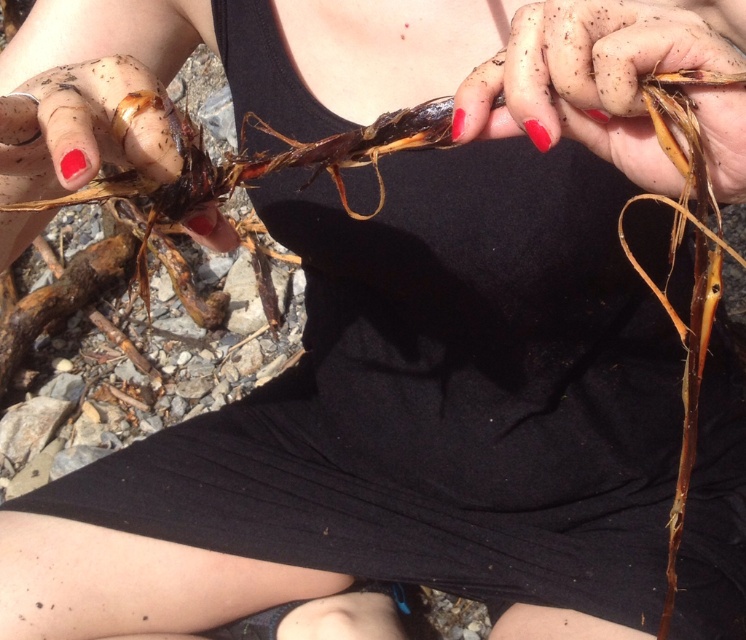
Question: Which point appears closest to the camera in this image?

Choices:
 (A) (151, 118)
 (B) (521, 65)

Answer: (B)

Question: Observing the image, what is the correct spatial positioning of dull brown skin at center in reference to matte brown root at left?

Choices:
 (A) right
 (B) left

Answer: (A)

Question: Which point is farther to the camera?

Choices:
 (A) dull brown skin at center
 (B) matte brown root at left

Answer: (B)

Question: Can you confirm if dull brown skin at center is positioned to the left of matte brown root at left?

Choices:
 (A) no
 (B) yes

Answer: (A)

Question: Which point appears closest to the camera in this image?

Choices:
 (A) (736, 52)
 (B) (131, 99)

Answer: (A)

Question: Is dull brown skin at center positioned before matte brown root at left?

Choices:
 (A) no
 (B) yes

Answer: (B)